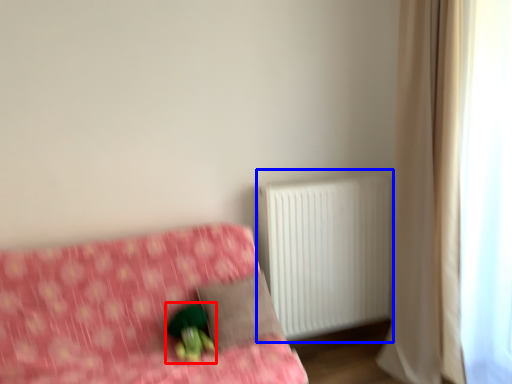
Question: Which of the following is the closest to the observer, figurine (highlighted by a red box) or radiator (highlighted by a blue box)?

Choices:
 (A) figurine
 (B) radiator

Answer: (A)